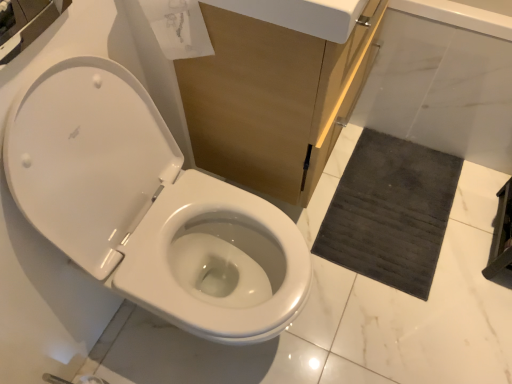
Where is `free space between matte wood cabinet at center and white marble bath at lower right`? The image size is (512, 384). free space between matte wood cabinet at center and white marble bath at lower right is located at coordinates click(x=394, y=187).